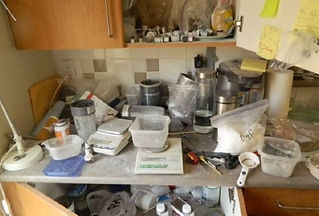
You are a GUI agent. You are given a task and a screenshot of the screen. Output one action in this format:
    pyautogui.click(x=<x>, y=<y>)
    Task: Click on the closed cabinet door
    
    Given the screenshot: What is the action you would take?
    pyautogui.click(x=88, y=19)